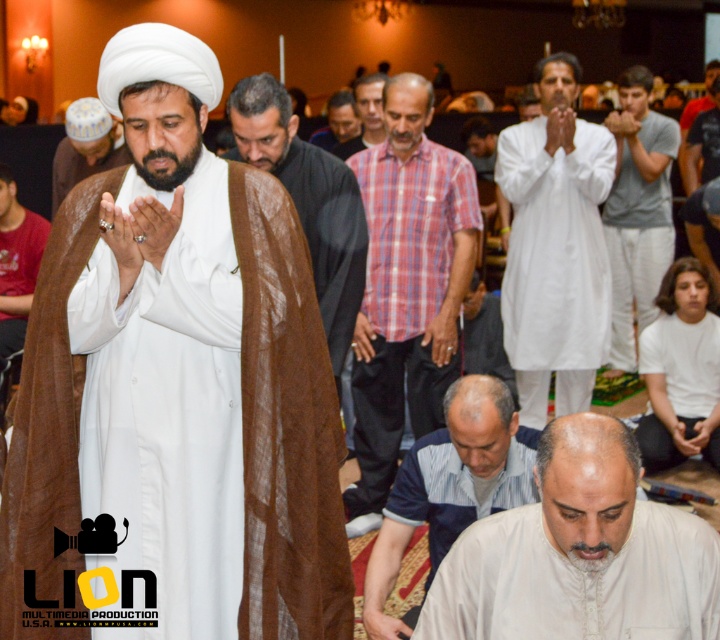
You are an interior designer analyzing the layout of this prayer space. You need to place a decorative rug exactly at the center of the room. The brown fabric shawl at center is currently positioned at coordinates 0.314, 0.428. Will the shawl be centered if you place the rug at the exact center of the room?

The brown fabric shawl at center is located at coordinates (307, 200), which is not exactly the center of the room. Therefore, placing the rug at the exact center would mean the shawl is slightly off to one side, so it won not be centered.

You are a photographer standing at the back of the room. You want to take a photo that includes both the white matte robe at center and the red shirt at left. The camera you are using has a maximum focus range of 10 feet. Will the two subjects be within the focus range of your camera?

The white matte robe at center is 9.94 feet from the red shirt at left. Since the distance between them is less than 10 feet, the camera can focus on both subjects within its maximum range.